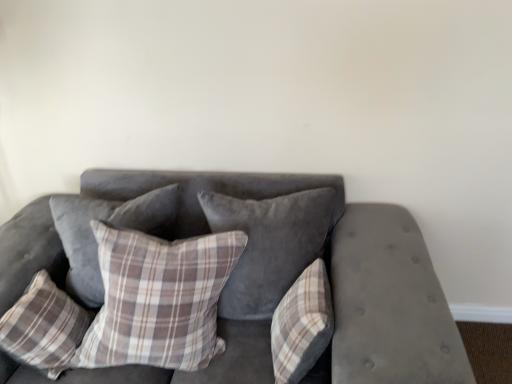
Question: Considering the relative sizes of plaid fabric pillow at center, which is counted as the 3th pillow, starting from the right, and velvet gray couch at center in the image provided, is plaid fabric pillow at center, which is counted as the 3th pillow, starting from the right, wider than velvet gray couch at center?

Choices:
 (A) yes
 (B) no

Answer: (B)

Question: Is plaid fabric pillow at center, which is counted as the 3th pillow, starting from the right, shorter than velvet gray couch at center?

Choices:
 (A) no
 (B) yes

Answer: (B)

Question: From a real-world perspective, is plaid fabric pillow at center, which is counted as the 3th pillow, starting from the right, on top of velvet gray couch at center?

Choices:
 (A) yes
 (B) no

Answer: (A)

Question: Is plaid fabric pillow at center, which is counted as the 3th pillow, starting from the right, not inside velvet gray couch at center?

Choices:
 (A) yes
 (B) no

Answer: (B)

Question: Does plaid fabric pillow at center, which is counted as the 3th pillow, starting from the right, appear on the left side of velvet gray couch at center?

Choices:
 (A) no
 (B) yes

Answer: (B)

Question: In the image, is plaid fabric pillow at center, which appears as the 3th pillow when viewed from the left, positioned in front of or behind plaid fabric pillow at center, the fifth pillow positioned from the left?

Choices:
 (A) behind
 (B) front

Answer: (B)

Question: Is plaid fabric pillow at center, which is counted as the 3th pillow, starting from the right, wider or thinner than plaid fabric pillow at center, positioned as the 1th pillow in right-to-left order?

Choices:
 (A) wide
 (B) thin

Answer: (A)

Question: Is plaid fabric pillow at center, which appears as the 3th pillow when viewed from the left, bigger or smaller than plaid fabric pillow at center, the fifth pillow positioned from the left?

Choices:
 (A) big
 (B) small

Answer: (A)

Question: Which is correct: plaid fabric pillow at center, which is counted as the 3th pillow, starting from the right, is inside plaid fabric pillow at center, positioned as the 1th pillow in right-to-left order, or outside of it?

Choices:
 (A) inside
 (B) outside

Answer: (B)

Question: From a real-world perspective, relative to plaid fabric pillow at center, positioned as the 1th pillow in right-to-left order, is plaid fabric pillow at lower left, acting as the fifth pillow starting from the right, vertically above or below?

Choices:
 (A) below
 (B) above

Answer: (A)

Question: Do you think plaid fabric pillow at lower left, acting as the fifth pillow starting from the right, is within plaid fabric pillow at center, the fifth pillow positioned from the left, or outside of it?

Choices:
 (A) inside
 (B) outside

Answer: (B)

Question: Is plaid fabric pillow at lower left, acting as the fifth pillow starting from the right, bigger or smaller than plaid fabric pillow at center, positioned as the 1th pillow in right-to-left order?

Choices:
 (A) big
 (B) small

Answer: (A)

Question: Based on their positions, is plaid fabric pillow at lower left, which is the first pillow from left to right, located to the left or right of plaid fabric pillow at center, positioned as the 1th pillow in right-to-left order?

Choices:
 (A) right
 (B) left

Answer: (B)

Question: Considering their positions, is plaid fabric pillow at lower left, acting as the fifth pillow starting from the right, located in front of or behind plaid fabric pillow at center, which is counted as the 3th pillow, starting from the right?

Choices:
 (A) front
 (B) behind

Answer: (B)

Question: Would you say plaid fabric pillow at lower left, acting as the fifth pillow starting from the right, is to the left or to the right of plaid fabric pillow at center, which is counted as the 3th pillow, starting from the right, in the picture?

Choices:
 (A) right
 (B) left

Answer: (B)